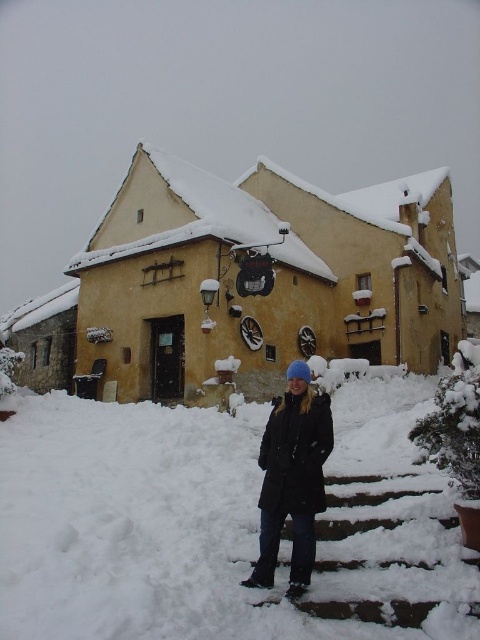
Is snow-covered stone stairs at lower center above black matte coat at lower center?

No, snow-covered stone stairs at lower center is not above black matte coat at lower center.

Can you confirm if snow-covered stone stairs at lower center is thinner than black matte coat at lower center?

No.

The height and width of the screenshot is (640, 480). I want to click on snow-covered stone stairs at lower center, so click(x=380, y=552).

Is point (222, 529) positioned before point (396, 502)?

That is True.

Which is behind, point (104, 456) or point (322, 577)?

Positioned behind is point (104, 456).

Which is in front, point (147, 540) or point (370, 508)?

Positioned in front is point (147, 540).

Identify the location of white fluffy snow at lower center. The height and width of the screenshot is (640, 480). (217, 524).

Can you confirm if white fluffy snow at lower center is wider than black matte coat at lower center?

Correct, the width of white fluffy snow at lower center exceeds that of black matte coat at lower center.

Does white fluffy snow at lower center have a lesser width compared to black matte coat at lower center?

No, white fluffy snow at lower center is not thinner than black matte coat at lower center.

Is point (396, 513) farther from camera compared to point (291, 532)?

No, it is in front of (291, 532).

Find the location of a particular element. The width and height of the screenshot is (480, 640). white fluffy snow at lower center is located at coordinates (217, 524).